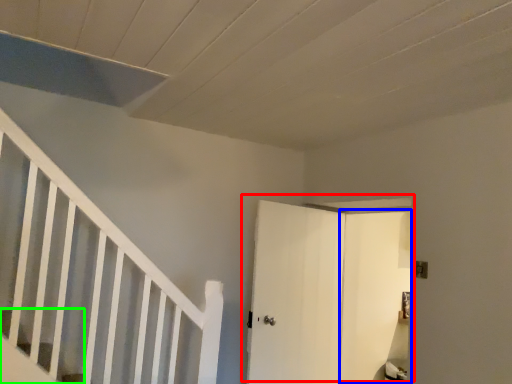
Question: Which object is the closest to the door (highlighted by a red box)? Choose among these: door (highlighted by a blue box) or stairs (highlighted by a green box).

Choices:
 (A) door
 (B) stairs

Answer: (A)